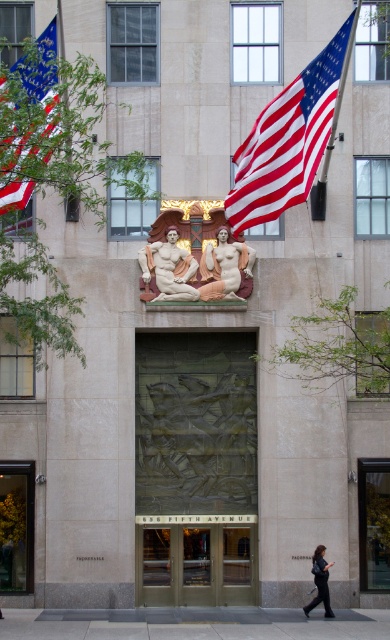
Does bronze relief at center appear on the right side of bronze relief sculpture at center?

In fact, bronze relief at center is to the left of bronze relief sculpture at center.

Does point (251, 500) lie behind point (359, 529)?

Yes, point (251, 500) is farther from viewer.

Where is `bronze relief at center`? This screenshot has width=390, height=640. bronze relief at center is located at coordinates (196, 442).

Between blue fabric flag at upper left and marble nude figures at center, which one is positioned higher?

blue fabric flag at upper left

The image size is (390, 640). I want to click on blue fabric flag at upper left, so click(42, 76).

Consider the image. How far apart are gold/glass doors at center and matte bronze statue at center?

gold/glass doors at center is 5.67 meters from matte bronze statue at center.

Is gold/glass doors at center taller than matte bronze statue at center?

Correct, gold/glass doors at center is much taller as matte bronze statue at center.

Does point (138, 577) lie behind point (163, 241)?

Yes, point (138, 577) is farther from viewer.

Where is `gold/glass doors at center`? This screenshot has height=640, width=390. gold/glass doors at center is located at coordinates (195, 564).